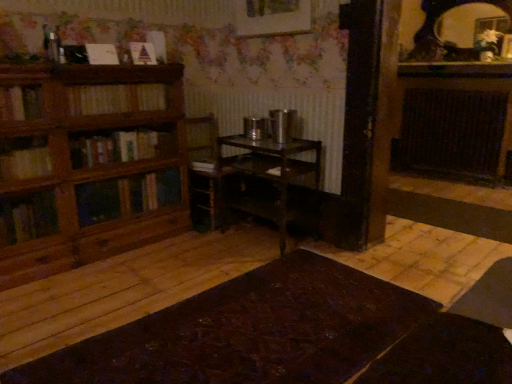
Question: Is wooden bookshelf at left spatially inside wooden bookshelf at left, the 1th book ordered from the bottom, or outside of it?

Choices:
 (A) inside
 (B) outside

Answer: (B)

Question: Is wooden bookshelf at left taller or shorter than wooden bookshelf at left, the 1th book ordered from the bottom?

Choices:
 (A) short
 (B) tall

Answer: (B)

Question: Which object is positioned closest to the wooden bookshelf at left?

Choices:
 (A) dark brown wooden table at center, positioned as the first table in bottom-to-top order
 (B) wooden picture frame at upper center
 (C) matte black mirror at upper right
 (D) matte paper book at upper left, placed as the first book when sorted from top to bottom
 (E) white paper at upper left, which ranks as the second book in bottom-to-top order

Answer: (E)

Question: Estimate the real-world distances between objects in this image. Which object is closer to the wooden bookshelf at left, which appears as the third book when viewed from the top?

Choices:
 (A) white paper at upper left, which is the 2th book in top-to-bottom order
 (B) metallic dark brown table at center, the second table positioned from the bottom
 (C) dark brown wooden radiator at right
 (D) matte paper book at upper left, which ranks as the 3th book in bottom-to-top order
 (E) wooden picture frame at upper center

Answer: (A)